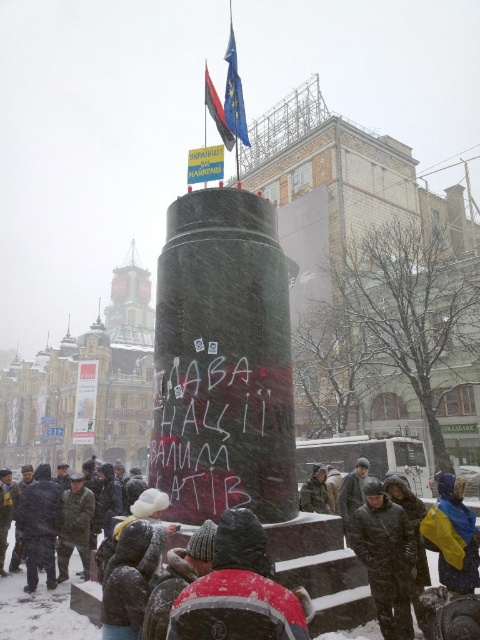
Question: Can you confirm if dark gray knit hat at lower center is thinner than yellow-blue fabric hat at lower right?

Choices:
 (A) no
 (B) yes

Answer: (B)

Question: Considering the real-world distances, which object is closest to the black marble pillar at center?

Choices:
 (A) dark gray winter coat at lower left
 (B) red knit hat at lower center
 (C) camouflage fabric jacket at center
 (D) dark gray knit hat at lower center

Answer: (D)

Question: Which point is farther to the camera?

Choices:
 (A) yellow-blue fabric hat at lower right
 (B) dark gray woolen hat at lower left

Answer: (B)

Question: Which point appears closest to the camera in this image?

Choices:
 (A) (340, 624)
 (B) (120, 634)
 (C) (39, 518)

Answer: (B)

Question: Where is dark gray knit hat at lower center located in relation to camouflage fabric jacket at center in the image?

Choices:
 (A) above
 (B) below

Answer: (A)

Question: Is camouflage uniform at center wider than camouflage fabric jacket at center?

Choices:
 (A) no
 (B) yes

Answer: (B)